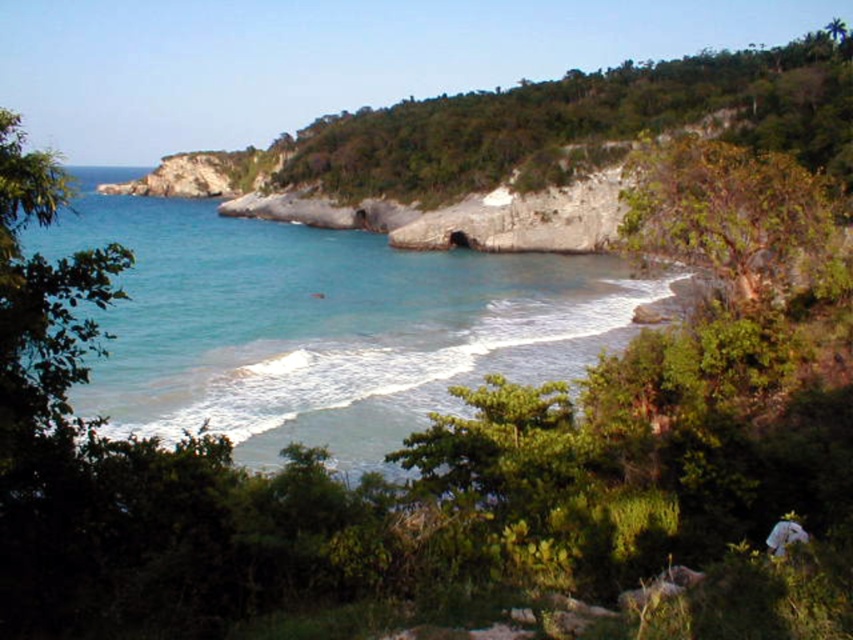
Between clear blue water at center and green leafy hillside at upper center, which one has more height?

Standing taller between the two is green leafy hillside at upper center.

Is clear blue water at center to the right of green leafy hillside at upper center from the viewer's perspective?

No, clear blue water at center is not to the right of green leafy hillside at upper center.

Is point (379, 358) closer to camera compared to point (776, 52)?

Yes, it is in front of point (776, 52).

This screenshot has width=853, height=640. I want to click on clear blue water at center, so click(x=318, y=324).